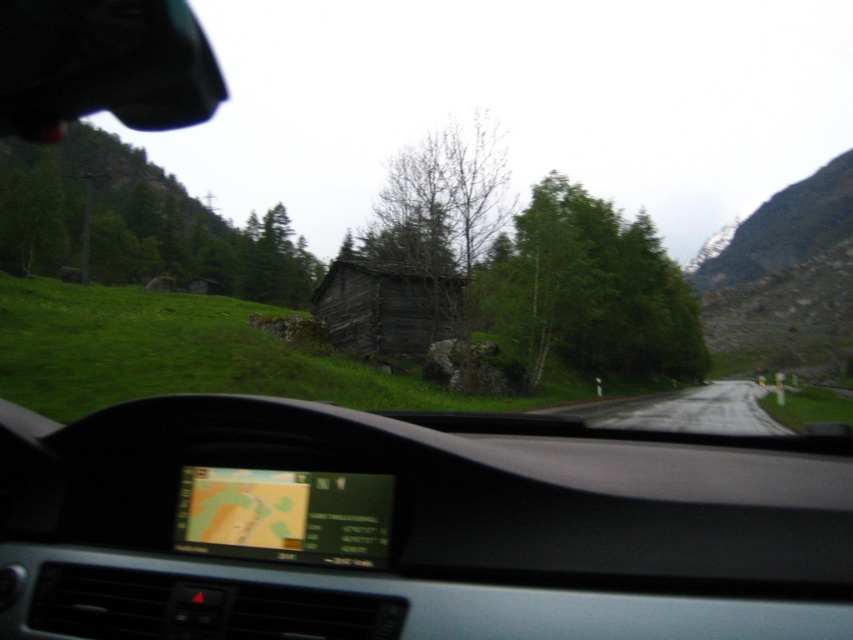
You are a passenger in the car and want to know which of the two points, point (599,240) or point (735,419), is closer to the windshield. Based on the scene description, can you determine which one is closer?

Point (735,419) is closer to the windshield because it is less further to the camera than point (599,240).

You are driving a car and need to determine if the green matte tree at center will block your view of the road ahead. Based on the scene description, can you see the gray asphalt road at center clearly through the windshield?

The green matte tree at center is much taller than the gray asphalt road at center, so the tree could block your view of the road ahead. However, since the tree is at the center and the road is also at center, it depends on the tree height relative to the windshield. If the tree is taller than the windshield height, it might block the view. But the description only states the tree is taller than the road, not the vehicle. Without knowing the vehicle height, we can only say the tree is taller than the road,